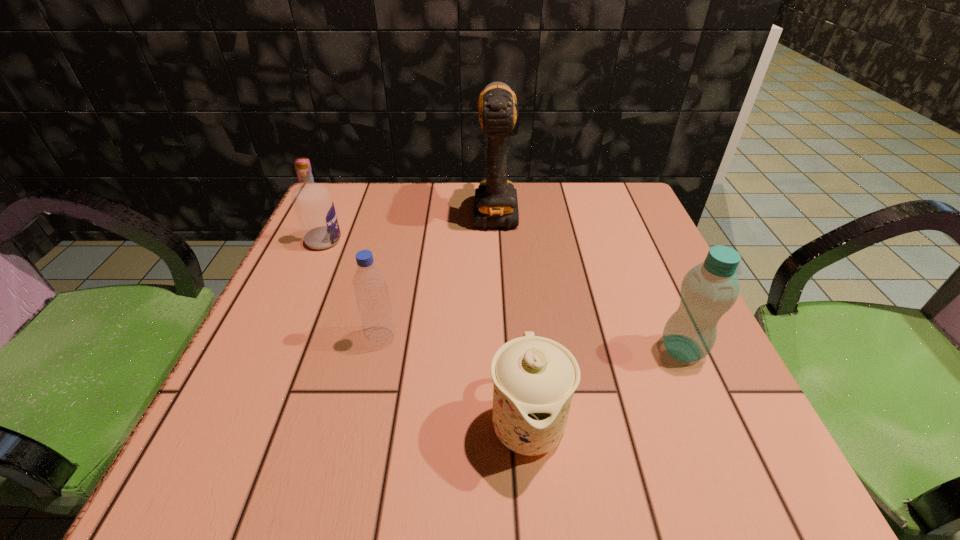
Locate an element on the screen. drill is located at coordinates (496, 205).

Where is `the right bottle`? The height and width of the screenshot is (540, 960). the right bottle is located at coordinates click(708, 290).

At what (x,y) coordinates should I click in order to perform the action: click on vodka. Please return your answer as a coordinate pair (x, y). The height and width of the screenshot is (540, 960). Looking at the image, I should click on click(312, 202).

What are the coordinates of `the fourth object from right to left` in the screenshot? It's located at (370, 286).

Where is `the nearest object`? the nearest object is located at coordinates (534, 378).

Where is `vacant space located 0.170m on the front of the right bottle`? vacant space located 0.170m on the front of the right bottle is located at coordinates (736, 471).

In order to click on free space located on the label of the leftmost object in this screenshot , I will do `click(524, 241)`.

What are the coordinates of `vacant space located on the right of the second object from left to right` in the screenshot? It's located at (491, 338).

Find the location of a particular element. The image size is (960, 540). drill situated at the far edge is located at coordinates pyautogui.click(x=496, y=205).

Identify the location of vodka that is at the far edge. (312, 202).